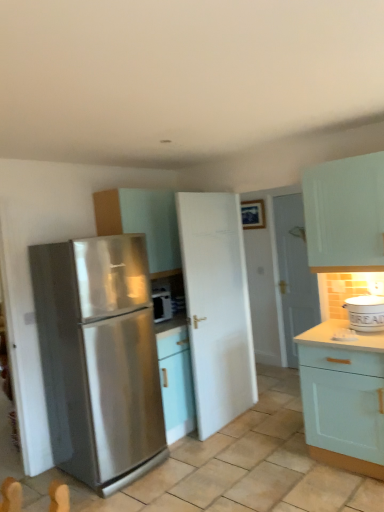
Locate an element on the screen. This screenshot has height=512, width=384. free location in front of white matte door at center, which ranks as the first door in front-to-back order is located at coordinates (236, 447).